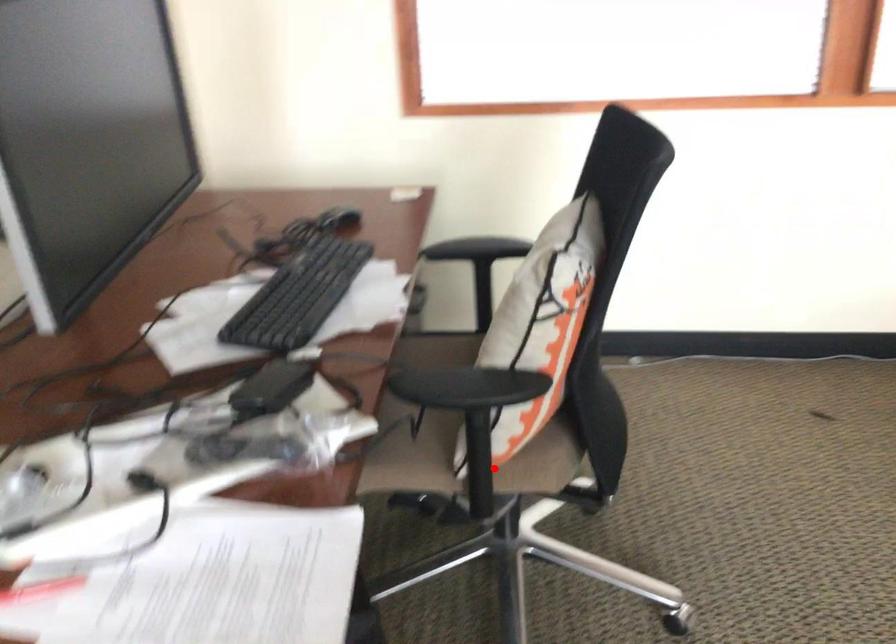
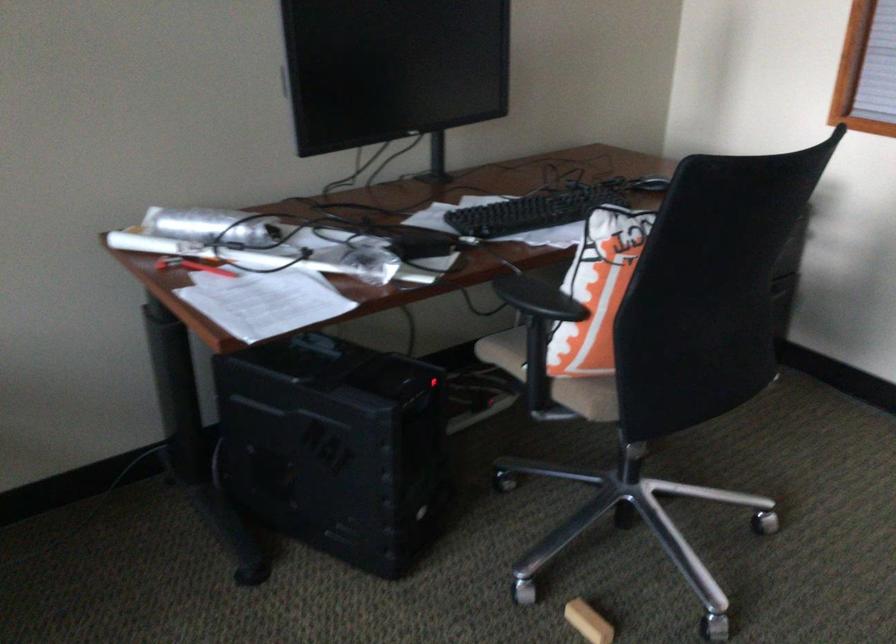
Question: I am providing you with two images of the same scene from different viewpoints. Image1 has a red point marked. In image2, the corresponding 3D location appears at what relative position? Reply with the corresponding letter.

Choices:
 (A) Closer
 (B) Farther

Answer: (B)